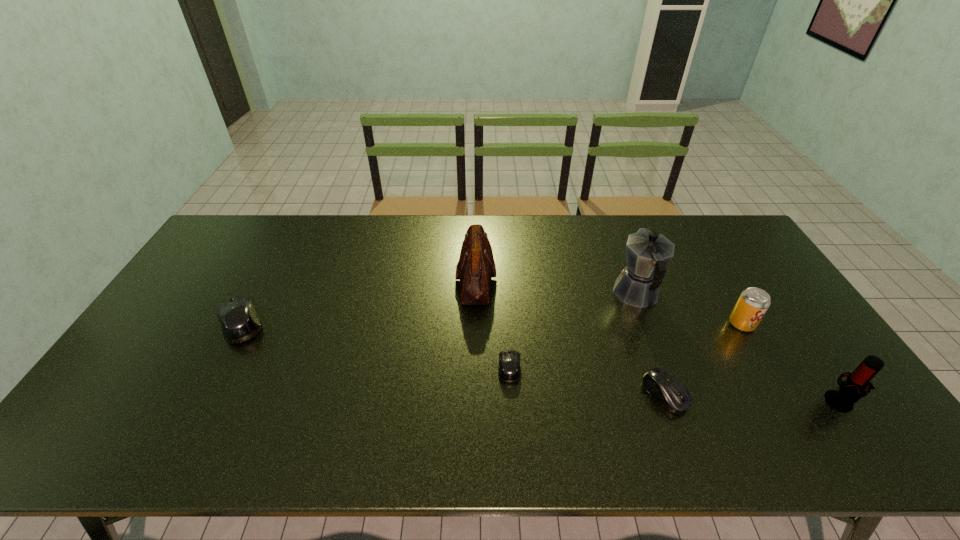
This screenshot has width=960, height=540. I want to click on free space between the sixth tallest object and the tallest mouse, so click(x=453, y=359).

Image resolution: width=960 pixels, height=540 pixels. I want to click on free spot between the second tallest mouse and the shoulder bag, so click(570, 337).

Identify the location of the sixth closest object relative to the shoulder bag. (850, 391).

Identify which object is the sixth nearest to the pop (soda). Please provide its 2D coordinates. Your answer should be formatted as a tuple, i.e. [(x, y)], where the tuple contains the x and y coordinates of a point satisfying the conditions above.

[(239, 320)]

Select which mouse is the third closest to the pop (soda). Please provide its 2D coordinates. Your answer should be formatted as a tuple, i.e. [(x, y)], where the tuple contains the x and y coordinates of a point satisfying the conditions above.

[(239, 320)]

Where is `mouse that is the second closest to the coffeepot`? The image size is (960, 540). mouse that is the second closest to the coffeepot is located at coordinates (509, 361).

This screenshot has width=960, height=540. What are the coordinates of `blank area in the image that satisfies the following two spatial constraints: 1. on the back side of the second object from right to left; 2. on the right side of the second tallest mouse` in the screenshot? It's located at (639, 323).

At what (x,y) coordinates should I click in order to perform the action: click on vacant space that satisfies the following two spatial constraints: 1. on the back side of the tallest mouse; 2. on the right side of the sixth shortest object. Please return your answer as a coordinate pair (x, y). Looking at the image, I should click on (265, 279).

This screenshot has height=540, width=960. I want to click on free location that satisfies the following two spatial constraints: 1. on the front side of the rightmost mouse; 2. on the left side of the sixth shortest object, so click(475, 394).

This screenshot has width=960, height=540. In order to click on vacant space that satisfies the following two spatial constraints: 1. on the front side of the shoulder bag; 2. on the left side of the microphone in this screenshot , I will do `click(474, 401)`.